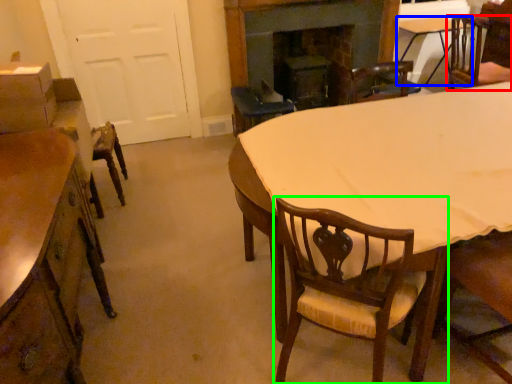
Question: Which object is the closest to the chair (highlighted by a red box)? Choose among these: table (highlighted by a blue box) or chair (highlighted by a green box).

Choices:
 (A) table
 (B) chair

Answer: (A)